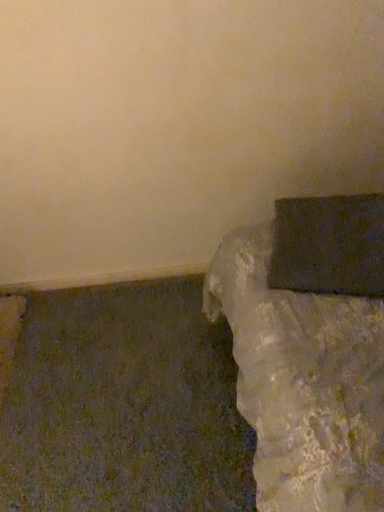
Image resolution: width=384 pixels, height=512 pixels. Identify the location of matte gray stone bench at right. (309, 350).

The height and width of the screenshot is (512, 384). What do you see at coordinates (309, 350) in the screenshot? I see `matte gray stone bench at right` at bounding box center [309, 350].

The width and height of the screenshot is (384, 512). Find the location of `matte gray stone bench at right`. matte gray stone bench at right is located at coordinates (309, 350).